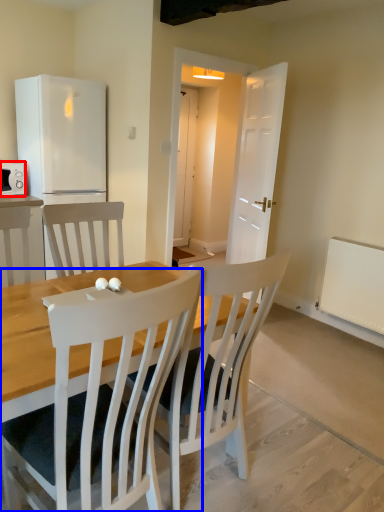
Question: Which object is further to the camera taking this photo, microwave oven (highlighted by a red box) or chair (highlighted by a blue box)?

Choices:
 (A) microwave oven
 (B) chair

Answer: (A)